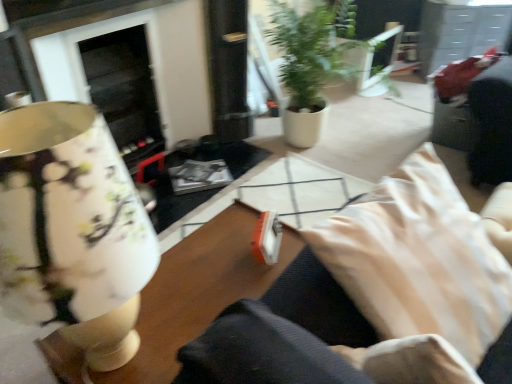
Locate an element on the screen. The height and width of the screenshot is (384, 512). free spot above wooden table at center (from a real-world perspective) is located at coordinates (203, 285).